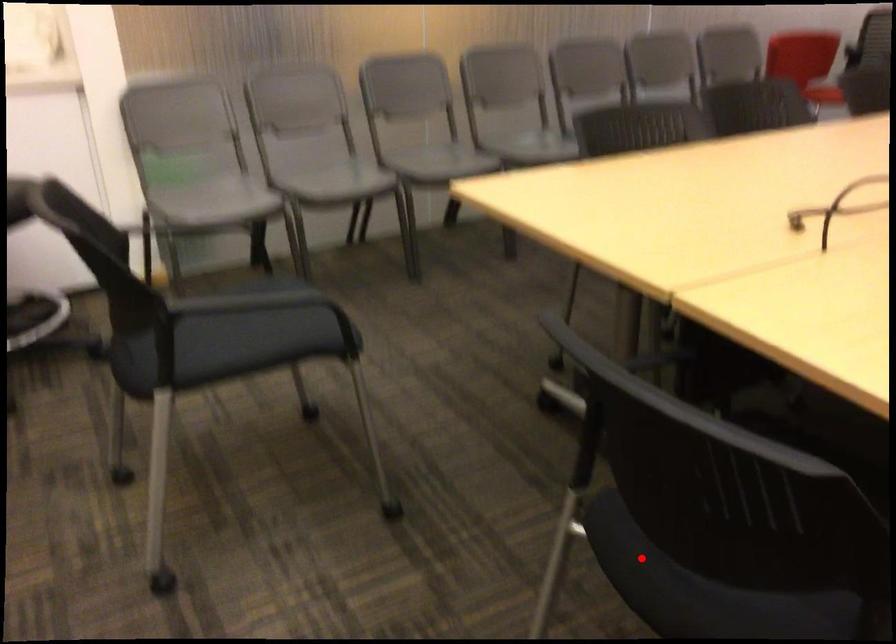
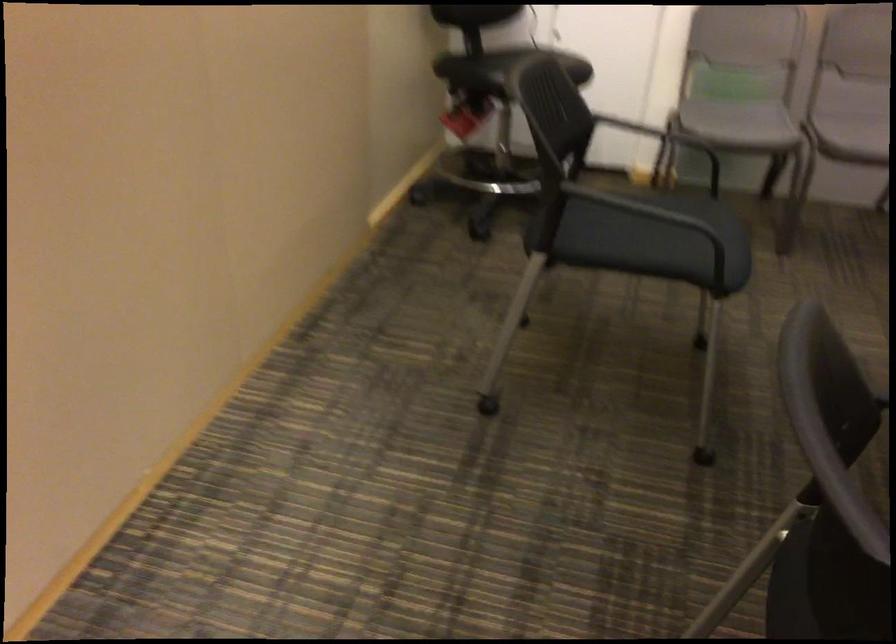
Question: I am providing you with two images of the same scene from different viewpoints. Given a red point in image1, look at the same physical point in image2. Is it:

Choices:
 (A) Closer to the viewpoint
 (B) Farther from the viewpoint

Answer: (A)